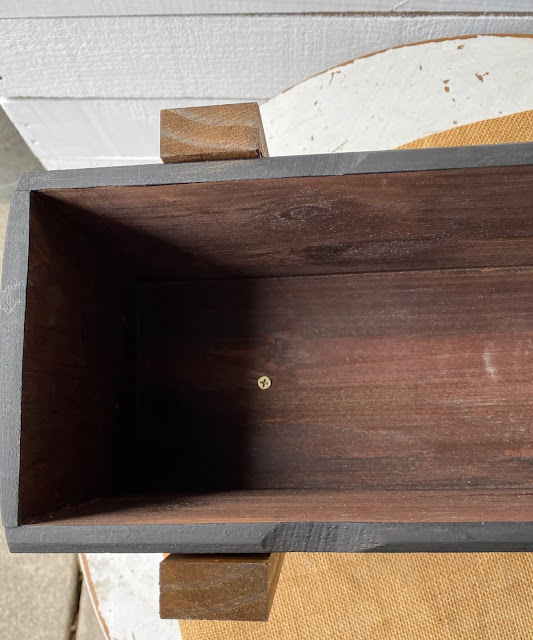
The width and height of the screenshot is (533, 640). Identify the location of white wooden slats. (18, 9), (115, 15), (51, 83), (66, 134), (300, 51).